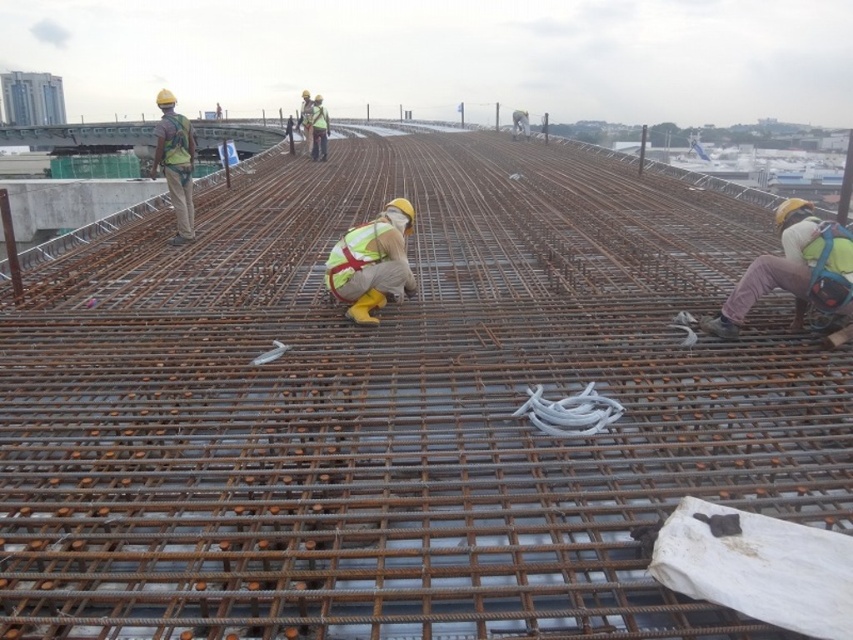
Can you confirm if light blue fabric at right is positioned to the right of reflective safety vest at center?

Correct, you'll find light blue fabric at right to the right of reflective safety vest at center.

Which of these two, light blue fabric at right or reflective safety vest at center, stands shorter?

light blue fabric at right

Is point (724, 321) behind point (396, 273)?

No, it is not.

Where is `light blue fabric at right`? light blue fabric at right is located at coordinates (793, 269).

Is reflective safety vest at center wider than matte yellow safety vest at upper left?

In fact, reflective safety vest at center might be narrower than matte yellow safety vest at upper left.

Which is in front, point (401, 296) or point (177, 220)?

Point (401, 296) is in front.

Is point (358, 257) in front of point (171, 168)?

Yes, it is.

The width and height of the screenshot is (853, 640). Identify the location of reflective safety vest at center. (372, 262).

Does light blue fabric at right come in front of matte yellow safety vest at upper left?

Yes, light blue fabric at right is closer to the viewer.

Does point (848, 260) lie behind point (171, 180)?

No, it is in front of (171, 180).

At what (x,y) coordinates should I click in order to perform the action: click on light blue fabric at right. Please return your answer as a coordinate pair (x, y). Looking at the image, I should click on (793, 269).